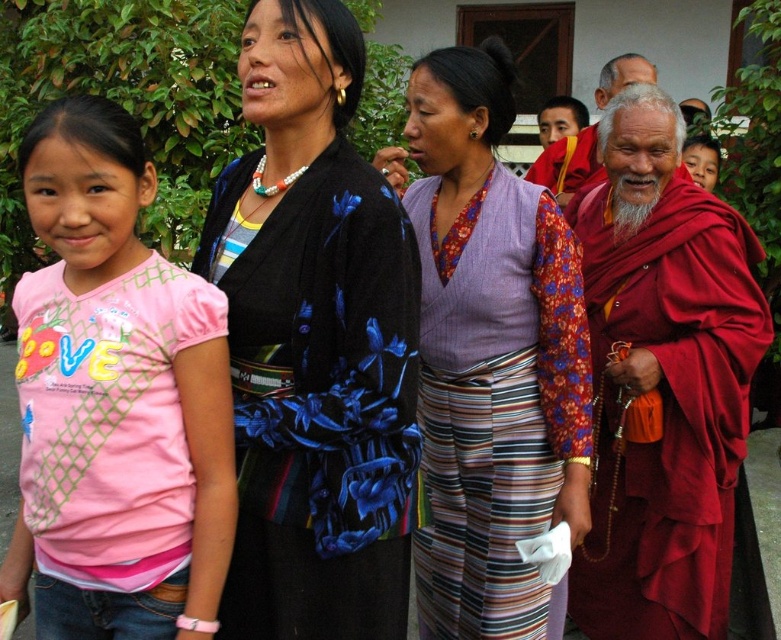
Question: Which object is the closest to the pink fabric shirt at left?

Choices:
 (A) red robe monk at upper right
 (B) maroon silk robe at right
 (C) purple woven vest at center

Answer: (C)

Question: Does blue floral fabric at center appear on the right side of maroon silk robe at right?

Choices:
 (A) no
 (B) yes

Answer: (A)

Question: Does maroon silk robe at right have a larger size compared to matte purple vest at center?

Choices:
 (A) yes
 (B) no

Answer: (A)

Question: Does maroon silk robe at right have a larger size compared to matte purple vest at center?

Choices:
 (A) no
 (B) yes

Answer: (B)

Question: Which of the following is the farthest from the observer?

Choices:
 (A) red robe monk at upper right
 (B) blue floral fabric at center

Answer: (A)

Question: Which point is farther to the camera?

Choices:
 (A) (294, 156)
 (B) (642, 76)

Answer: (B)